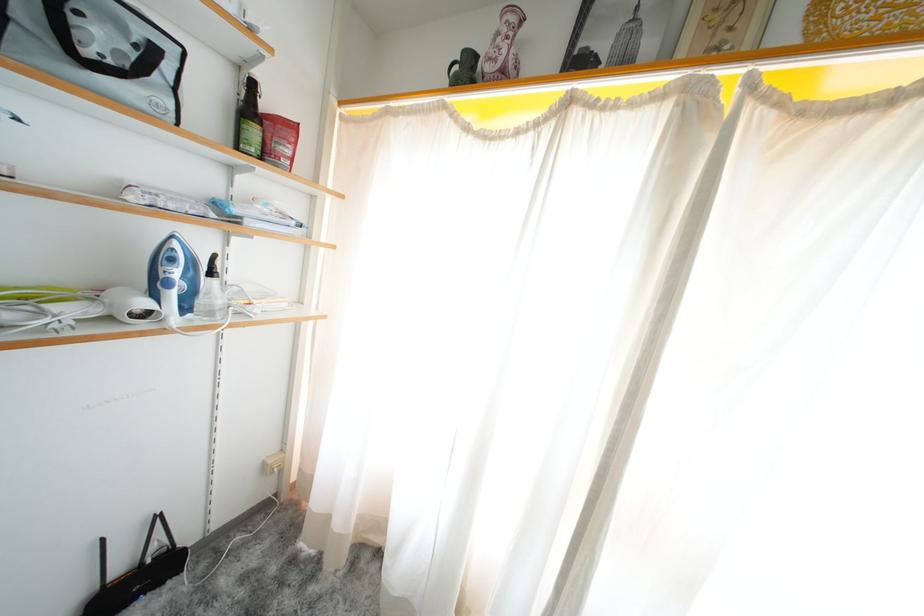
Find where to pull the white curtain. Please return your answer as a coordinate pair (x, y).

(456, 290)